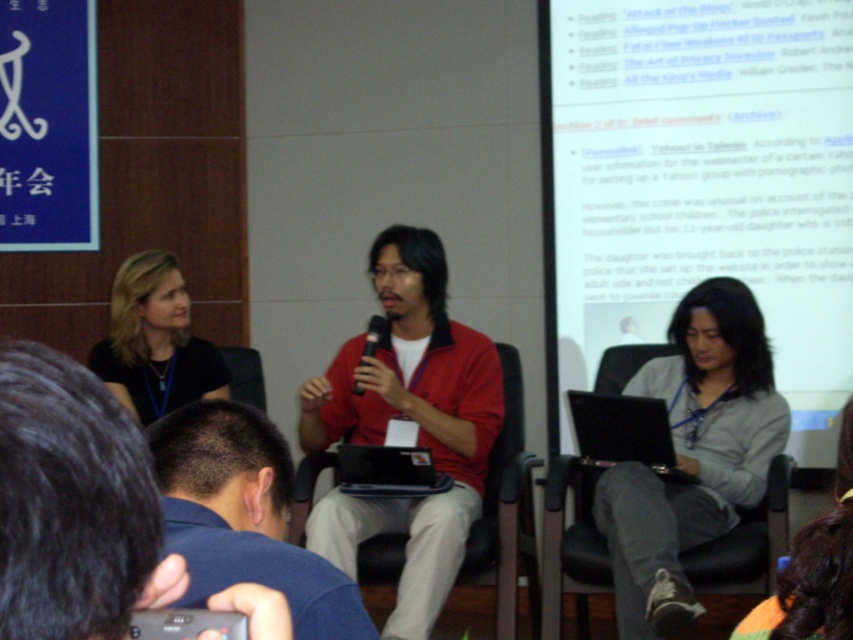
Question: Is gray fabric shirt at center wider than black matte microphone at center?

Choices:
 (A) yes
 (B) no

Answer: (A)

Question: Considering the relative positions of matte red jacket at center and black fabric shirt at left in the image provided, where is matte red jacket at center located with respect to black fabric shirt at left?

Choices:
 (A) left
 (B) right

Answer: (B)

Question: Is matte black laptop at center positioned behind black fabric shirt at left?

Choices:
 (A) yes
 (B) no

Answer: (B)

Question: Among these objects, which one is farthest from the camera?

Choices:
 (A) black glossy laptop at center right
 (B) white paper at upper right
 (C) gray fabric jacket at lower right

Answer: (B)

Question: Which point is farther to the camera?

Choices:
 (A) matte red jacket at center
 (B) black plastic laptop at center
 (C) black glossy laptop at center right

Answer: (B)

Question: Which point is closer to the camera?

Choices:
 (A) 183,605
 (B) 611,269
 (C) 399,449
 (D) 807,586

Answer: (D)